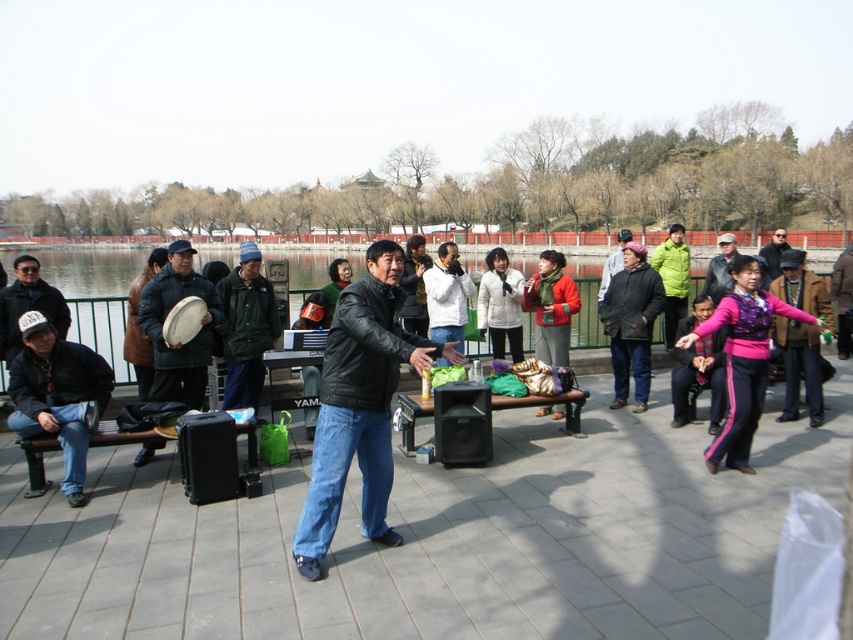
You are a photographer standing at the edge of the water. You want to take a photo of both the black leather jacket at center and the matte black jacket at left in the same frame. The camera you are using has a maximum focus range of 2.5 meters. Will you be able to capture both jackets in focus?

The black leather jacket at center is 2.43 meters away from the matte black jacket at left. Since the distance between them is within the camera maximum focus range of 2.5 meters, you can capture both jackets in focus.

Looking at this image, you are a photographer taking a picture of the scene. You want to ensure both the black leather jacket at center and the green matte jacket at center are clearly visible in the frame. Which jacket should you focus on first to ensure the other is also in focus?

The black leather jacket at center is located below the green matte jacket at center. Since they are both at the center, focusing on the green matte jacket at center first will ensure the black leather jacket at center is also in focus due to their vertical alignment.